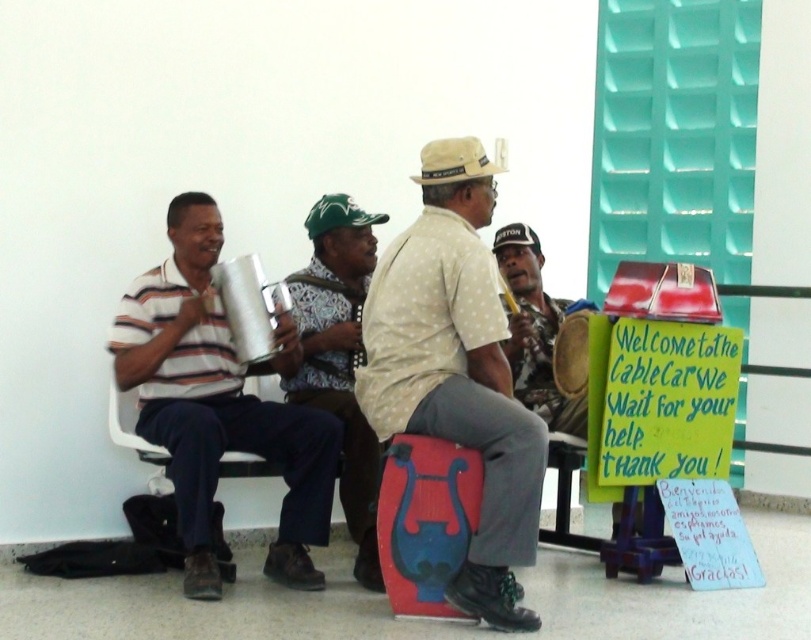
You are a photographer standing at the origin point of the coordinate system. You need to take a photo of both the point at (357, 225) and the point at (324, 195). Which point should you focus on first if you want to capture both in a single frame without moving the camera?

You should focus on the point at (324, 195) first because it is behind the point at (357, 225), allowing both to be in the frame when focused on the farther point.

You are a photographer trying to capture a candid shot of the two people wearing hats in the center of the group. The camera you are using has a lens that can focus on objects within a 10 inch range. Will you be able to capture both the patterned fabric hat at center and the green fabric baseball cap at center in the same focused shot?

The patterned fabric hat at center and green fabric baseball cap at center are 10.80 inches apart from each other. Since the camera lens can only focus within a 10 inch range, the distance between them exceeds this limit. Therefore, you cannot capture both hats in the same focused shot.

You are a photographer trying to capture a candid shot of the white dotted shirt at center and the white cotton baseball cap at center in the scene. Which object should you focus on first to ensure both are in the frame?

The white dotted shirt at center is closer to the viewer than the white cotton baseball cap at center, so focus on the white dotted shirt at center first to ensure both are in the frame.